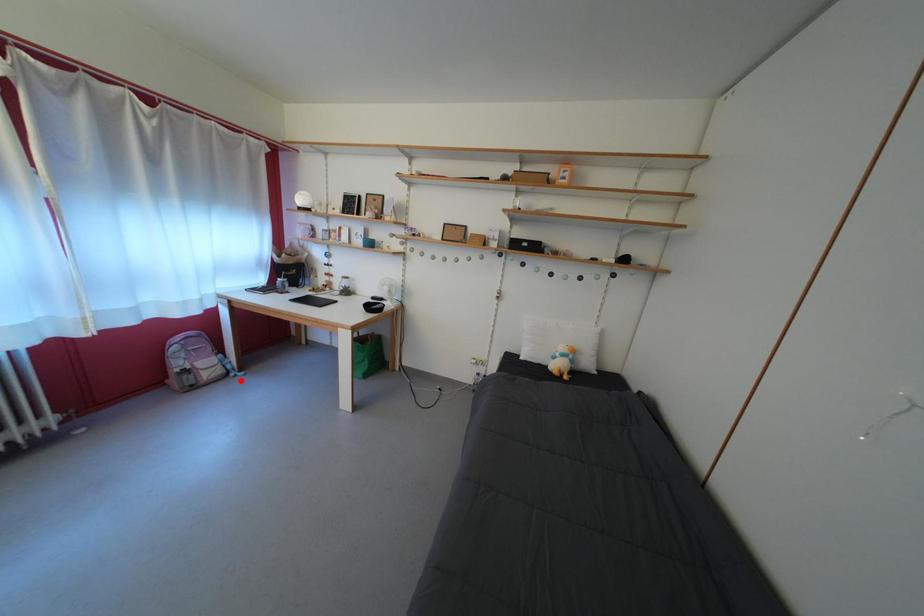
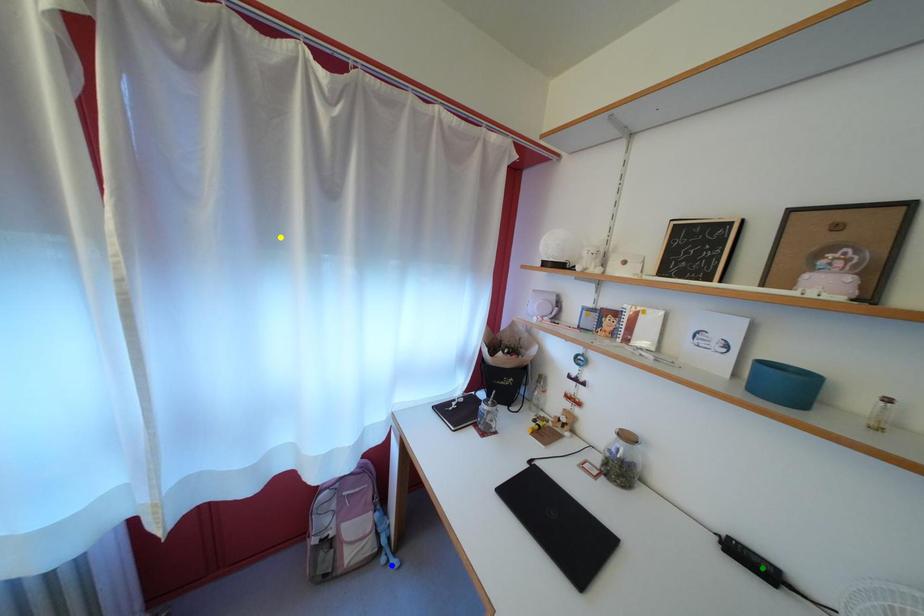
Question: I am providing you with two images of the same scene from different viewpoints. A red point is marked on the first image. You are given multiple points on the second image. Which point in image 2 represents the same 3d spot as the red point in image 1?

Choices:
 (A) blue point
 (B) green point
 (C) yellow point

Answer: (A)